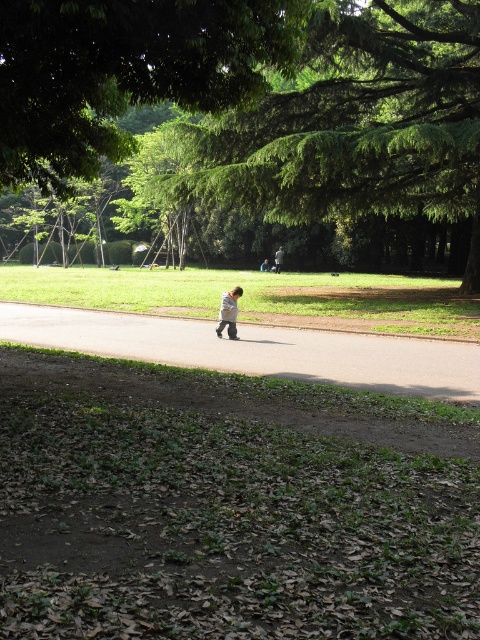
Between point (48, 173) and point (360, 374), which one is positioned behind?

The point (48, 173) is more distant.

Between green leafy tree at upper center and smooth asphalt path at center, which one is positioned higher?

green leafy tree at upper center is higher up.

Which is behind, point (110, 86) or point (227, 368)?

Positioned behind is point (227, 368).

At what (x,y) coordinates should I click in order to perform the action: click on green leafy tree at upper center. Please return your answer as a coordinate pair (x, y). The width and height of the screenshot is (480, 640). Looking at the image, I should click on (124, 72).

Who is higher up, green leafy tree at upper center or light gray cotton shirt at center?

green leafy tree at upper center

Who is more forward, (280, 42) or (227, 304)?

Point (280, 42) is in front.

Does point (96, 13) lie behind point (229, 317)?

No, (96, 13) is in front of (229, 317).

Locate an element on the screen. The image size is (480, 640). green leafy tree at upper center is located at coordinates (124, 72).

Based on the photo, between smooth asphalt path at center and light gray fabric jacket at center, which one is positioned higher?

light gray fabric jacket at center is above.

Who is more forward, (49,344) or (275,259)?

Point (49,344) is more forward.

Locate an element on the screen. smooth asphalt path at center is located at coordinates click(256, 349).